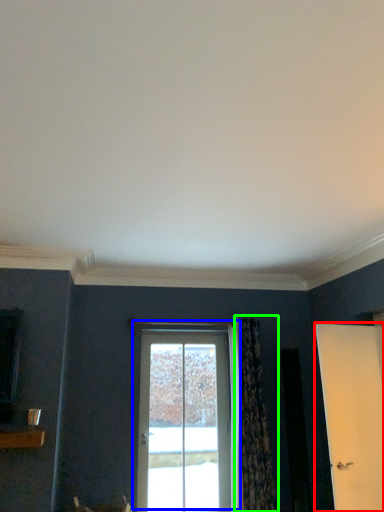
Question: Which object is positioned closest to door (highlighted by a red box)? Select from door (highlighted by a blue box) and curtain (highlighted by a green box).

Choices:
 (A) door
 (B) curtain

Answer: (B)